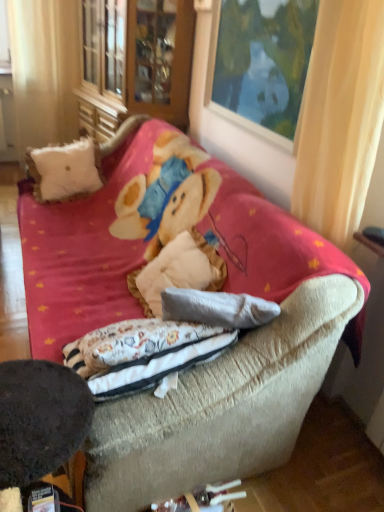
What is the approximate height of velvet beige couch at center?

35.06 inches.

What is the approximate width of yellow fabric curtain at upper right, which is the first curtain from right to left?

yellow fabric curtain at upper right, which is the first curtain from right to left, is 28.17 centimeters in width.

Identify the location of wooden cabinet at upper left. The height and width of the screenshot is (512, 384). click(134, 62).

Identify the location of dark brown felt round table at lower left. This screenshot has height=512, width=384. (40, 418).

In order to click on velvet beige couch at center in this screenshot , I will do 246,292.

Is point (193, 27) positioned before point (333, 236)?

No.

From the image's perspective, is wooden cabinet at upper left located above yellow fabric curtain at upper right, the second curtain from the left?

Yes, from the image's perspective, wooden cabinet at upper left is above yellow fabric curtain at upper right, the second curtain from the left.

Which object is closer to the camera, wooden cabinet at upper left or yellow fabric curtain at upper right, which is the 2th curtain in back-to-front order?

yellow fabric curtain at upper right, which is the 2th curtain in back-to-front order, is closer to the camera.

Considering the sizes of objects wooden cabinet at upper left and yellow fabric curtain at upper right, marked as the 2th curtain in a top-to-bottom arrangement, in the image provided, who is thinner, wooden cabinet at upper left or yellow fabric curtain at upper right, marked as the 2th curtain in a top-to-bottom arrangement,?

yellow fabric curtain at upper right, marked as the 2th curtain in a top-to-bottom arrangement, is thinner.

Considering the positions of objects velvet beige couch at center and dark brown felt round table at lower left in the image provided, who is more to the right, velvet beige couch at center or dark brown felt round table at lower left?

From the viewer's perspective, velvet beige couch at center appears more on the right side.

Does velvet beige couch at center have a lesser height compared to dark brown felt round table at lower left?

Incorrect, the height of velvet beige couch at center does not fall short of that of dark brown felt round table at lower left.

In the scene shown: Is velvet beige couch at center turned away from dark brown felt round table at lower left?

No, dark brown felt round table at lower left is not at the back of velvet beige couch at center.

From the image's perspective, would you say velvet beige couch at center is shown under dark brown felt round table at lower left?

No, from the image's perspective, velvet beige couch at center is not beneath dark brown felt round table at lower left.

Considering the positions of points (316, 170) and (128, 100), is point (316, 170) farther from camera compared to point (128, 100)?

No, (316, 170) is closer to viewer.

Is yellow fabric curtain at upper right, acting as the 1th curtain starting from the bottom, not near wooden cabinet at upper left?

That's right, there is a large distance between yellow fabric curtain at upper right, acting as the 1th curtain starting from the bottom, and wooden cabinet at upper left.

From the image's perspective, is yellow fabric curtain at upper right, which is counted as the first curtain, starting from the front, on top of wooden cabinet at upper left?

Incorrect, from the image's perspective, yellow fabric curtain at upper right, which is counted as the first curtain, starting from the front, is lower than wooden cabinet at upper left.

In the image, is velvet beige couch at center positioned in front of or behind white fluffy pillow at upper left?

Visually, velvet beige couch at center is located in front of white fluffy pillow at upper left.

Between velvet beige couch at center and white fluffy pillow at upper left, which one appears on the right side from the viewer's perspective?

velvet beige couch at center is more to the right.

Looking at the image, does velvet beige couch at center seem bigger or smaller compared to white fluffy pillow at upper left?

In the image, velvet beige couch at center appears to be larger than white fluffy pillow at upper left.

Between velvet beige couch at center and white fluffy pillow at upper left, which one has smaller width?

white fluffy pillow at upper left is thinner.

Visually, is wooden cabinet at upper left positioned to the left or to the right of wooden picture frame at upper center?

In the image, wooden cabinet at upper left appears on the left side of wooden picture frame at upper center.

In the image, is wooden cabinet at upper left positioned in front of or behind wooden picture frame at upper center?

Visually, wooden cabinet at upper left is located behind wooden picture frame at upper center.

Can you tell me how much wooden cabinet at upper left and wooden picture frame at upper center differ in facing direction?

They differ by 1.25 degrees in their facing directions.

In the scene shown: Are wooden cabinet at upper left and wooden picture frame at upper center far apart?

wooden cabinet at upper left is actually quite close to wooden picture frame at upper center.

Considering the sizes of objects white fabric curtain at left, placed as the first curtain when sorted from back to front, and white fluffy pillow at upper left in the image provided, who is wider, white fabric curtain at left, placed as the first curtain when sorted from back to front, or white fluffy pillow at upper left?

white fluffy pillow at upper left is wider.

In the image, is white fabric curtain at left, placed as the first curtain when sorted from back to front, positioned in front of or behind white fluffy pillow at upper left?

Clearly, white fabric curtain at left, placed as the first curtain when sorted from back to front, is behind white fluffy pillow at upper left.

Which of these two, white fabric curtain at left, the second curtain from the front, or white fluffy pillow at upper left, stands taller?

white fabric curtain at left, the second curtain from the front.

Is white fabric curtain at left, acting as the second curtain starting from the right, positioned beyond the bounds of white fluffy pillow at upper left?

Yes, white fabric curtain at left, acting as the second curtain starting from the right, is outside of white fluffy pillow at upper left.

From a real-world perspective, is velvet beige couch at center physically above wooden cabinet at upper left?

No, from a real-world perspective, velvet beige couch at center is not above wooden cabinet at upper left.

Is wooden cabinet at upper left located within velvet beige couch at center?

That's incorrect, wooden cabinet at upper left is not inside velvet beige couch at center.

Considering the sizes of objects velvet beige couch at center and wooden cabinet at upper left in the image provided, who is bigger, velvet beige couch at center or wooden cabinet at upper left?

With larger size is velvet beige couch at center.

Identify the location of curtain below the wooden cabinet at upper left (from the image's perspective). (340, 117).

I want to click on studio couch that is behind the dark brown felt round table at lower left, so click(246, 292).

Estimate the real-world distances between objects in this image. Which object is closer to white fabric curtain at left, placed as the first curtain when sorted from top to bottom, white fluffy pillow at upper left or wooden cabinet at upper left?

Based on the image, wooden cabinet at upper left appears to be nearer to white fabric curtain at left, placed as the first curtain when sorted from top to bottom.

Based on their spatial positions, is velvet beige couch at center or wooden cabinet at upper left closer to white fluffy pillow at upper left?

Among the two, velvet beige couch at center is located nearer to white fluffy pillow at upper left.

In the scene shown: Based on their spatial positions, is white fabric curtain at left, the second curtain positioned from the bottom, or wooden cabinet at upper left closer to wooden picture frame at upper center?

wooden cabinet at upper left is positioned closer to the anchor wooden picture frame at upper center.

Looking at this image, which object lies nearer to the anchor point white fluffy pillow at upper left, yellow fabric curtain at upper right, which is the first curtain from right to left, or velvet beige couch at center?

velvet beige couch at center is positioned closer to the anchor white fluffy pillow at upper left.

Considering their positions, is wooden picture frame at upper center positioned closer to white fluffy pillow at upper left than wooden cabinet at upper left?

wooden cabinet at upper left is closer to white fluffy pillow at upper left.

Based on their spatial positions, is dark brown felt round table at lower left or wooden cabinet at upper left further from yellow fabric curtain at upper right, the second curtain from the left?

wooden cabinet at upper left is further to yellow fabric curtain at upper right, the second curtain from the left.

From the image, which object appears to be farther from dark brown felt round table at lower left, wooden picture frame at upper center or yellow fabric curtain at upper right, the second curtain from the left?

Based on the image, wooden picture frame at upper center appears to be further to dark brown felt round table at lower left.

Looking at the image, which one is located further to white fluffy pillow at upper left, yellow fabric curtain at upper right, the second curtain from the left, or white fabric curtain at left, placed as the first curtain when sorted from back to front?

yellow fabric curtain at upper right, the second curtain from the left, lies further to white fluffy pillow at upper left than the other object.

Locate an element on the screen. This screenshot has width=384, height=512. throw pillow positioned between wooden picture frame at upper center and white fabric curtain at left, the second curtain from the front, from near to far is located at coordinates (64, 170).

The height and width of the screenshot is (512, 384). Identify the location of studio couch between yellow fabric curtain at upper right, marked as the 2th curtain in a top-to-bottom arrangement, and dark brown felt round table at lower left from top to bottom. (246, 292).

You are a GUI agent. You are given a task and a screenshot of the screen. Output one action in this format:
    pyautogui.click(x=<x>, y=<y>)
    Task: Click on the curtain between dark brown felt round table at lower left and white fabric curtain at left, placed as the first curtain when sorted from top to bottom, in the front-back direction
    Image resolution: width=384 pixels, height=512 pixels.
    Given the screenshot: What is the action you would take?
    pyautogui.click(x=340, y=117)

Identify the location of picture frame between velvet beige couch at center and wooden cabinet at upper left from front to back. (261, 63).